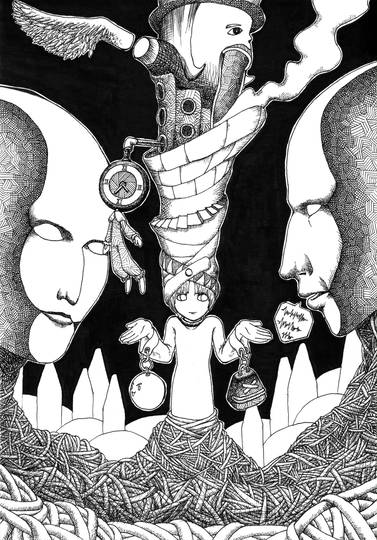
This screenshot has height=540, width=377. I want to click on stairway, so click(x=186, y=220), click(x=160, y=220), click(x=214, y=208).